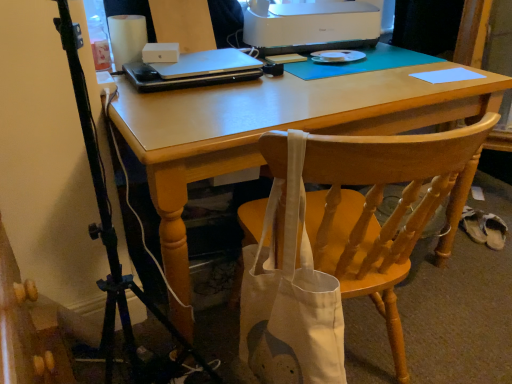
I want to click on free location above matte wooden desk at center (from a real-world perspective), so click(306, 78).